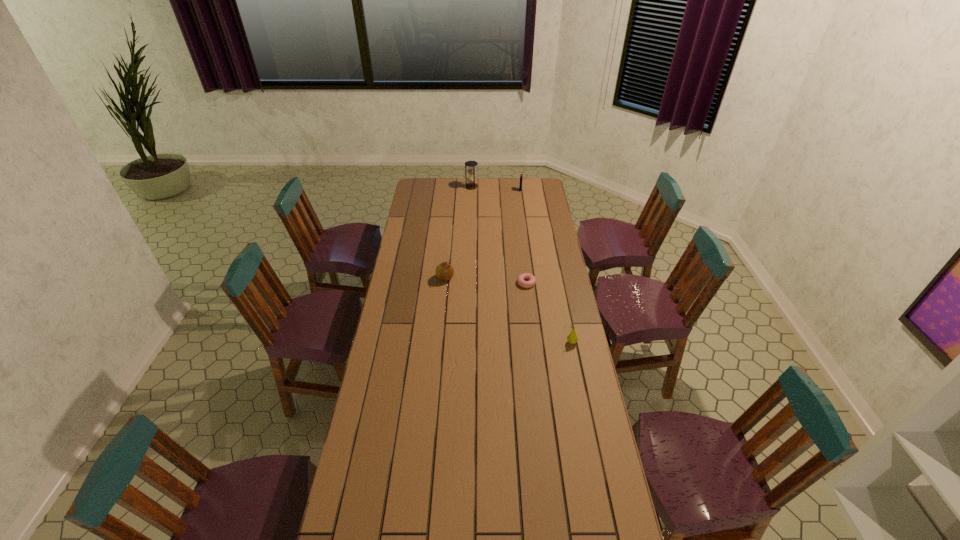
Locate an element on the screen. This screenshot has height=540, width=960. object that stands as the fourth closest to the shorter pear is located at coordinates (471, 184).

You are a GUI agent. You are given a task and a screenshot of the screen. Output one action in this format:
    pyautogui.click(x=<x>, y=<y>)
    Task: Click on the vacant position in the image that satisfies the following two spatial constraints: 1. on the front side of the fourth tallest object; 2. on the right side of the leftmost object
    This screenshot has width=960, height=540.
    Given the screenshot: What is the action you would take?
    pyautogui.click(x=439, y=342)

Where is `vacant space that satisfies the following two spatial constraints: 1. on the front side of the igniter; 2. on the right side of the fourth object from right to left`? This screenshot has width=960, height=540. vacant space that satisfies the following two spatial constraints: 1. on the front side of the igniter; 2. on the right side of the fourth object from right to left is located at coordinates (471, 190).